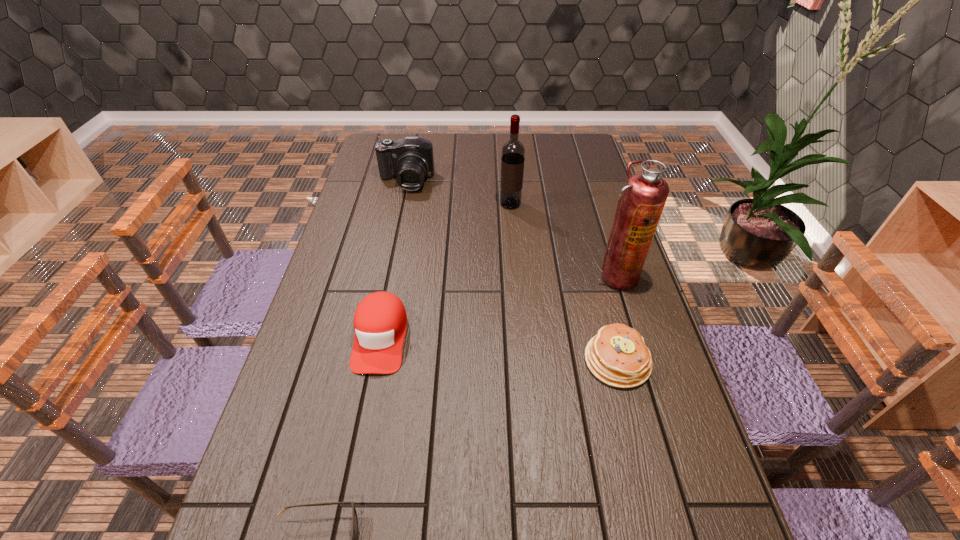
Where is `fire extinguisher`? fire extinguisher is located at coordinates (645, 194).

Locate an element on the screen. wine bottle is located at coordinates (513, 151).

Where is `the fourth object from left to right`? the fourth object from left to right is located at coordinates point(513,151).

I want to click on the fourth shortest object, so [410, 159].

I want to click on camera, so click(x=410, y=159).

Identify the location of the fourth tallest object. (380, 321).

Where is `pancake`? The image size is (960, 540). pancake is located at coordinates (617, 355).

Find the location of `vacant space situated 0.230m on the side of the fourth nearest object with the label`. vacant space situated 0.230m on the side of the fourth nearest object with the label is located at coordinates (641, 361).

The image size is (960, 540). Identify the location of free region located 0.370m on the back of the third object from right to left. (506, 146).

The image size is (960, 540). I want to click on free space located on the lens of the camera, so click(395, 235).